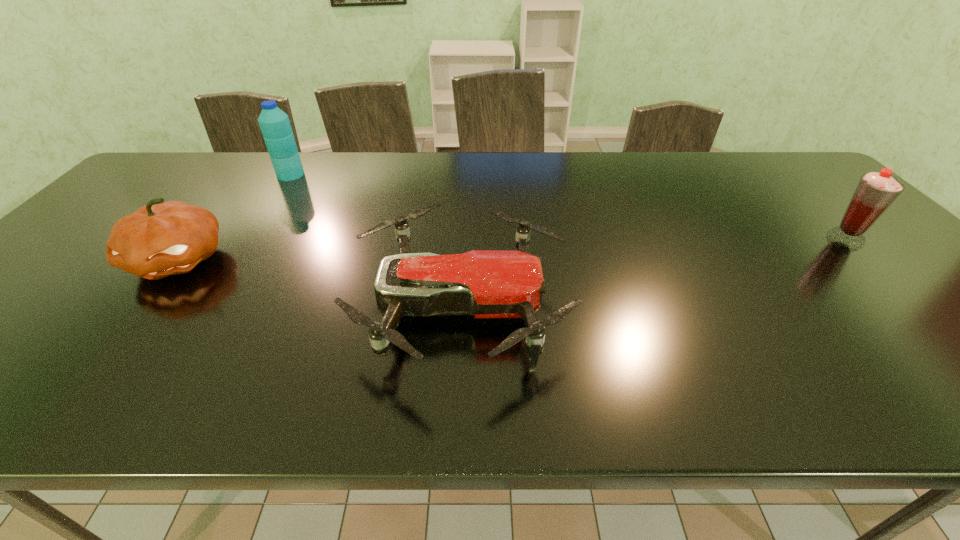
Identify the location of object at the near edge. (489, 284).

Find the location of a particular element. The image size is (960, 540). object that is at the right edge is located at coordinates (875, 192).

I want to click on vacant space at the far edge of the desktop, so click(x=441, y=167).

This screenshot has height=540, width=960. Find the location of `free location at the left edge`. free location at the left edge is located at coordinates (98, 252).

What are the coordinates of `free space at the right edge of the desktop` in the screenshot? It's located at (837, 204).

You are a GUI agent. You are given a task and a screenshot of the screen. Output one action in this format:
    pyautogui.click(x=<x>, y=<y>)
    Task: Click on the vacant space at the far left corner
    The image size is (960, 540).
    Given the screenshot: What is the action you would take?
    pyautogui.click(x=202, y=163)

At what (x,y) coordinates should I click in order to perform the action: click on vacant space at the far right corner of the desktop. Please return your answer as a coordinate pair (x, y). Looking at the image, I should click on (x=777, y=172).

Locate an element on the screen. vacant area between the drone and the water bottle is located at coordinates (376, 241).

You are a GUI agent. You are given a task and a screenshot of the screen. Output one action in this format:
    pyautogui.click(x=<x>, y=<y>)
    Task: Click on the free space between the rightmost object and the water bottle
    The image size is (960, 540).
    Given the screenshot: What is the action you would take?
    pyautogui.click(x=568, y=207)

Locate an element on the screen. The image size is (960, 540). vacant space that is in between the third tallest object and the water bottle is located at coordinates (234, 218).